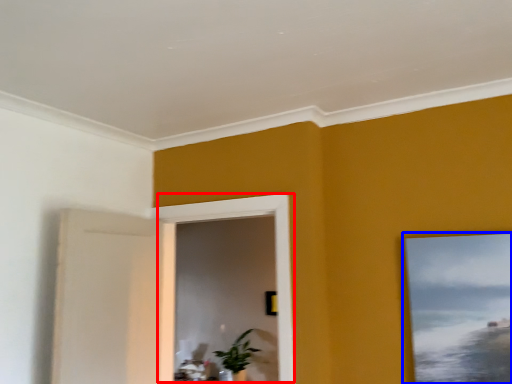
Question: Which object appears farthest to the camera in this image, window (highlighted by a red box) or picture frame (highlighted by a blue box)?

Choices:
 (A) window
 (B) picture frame

Answer: (A)